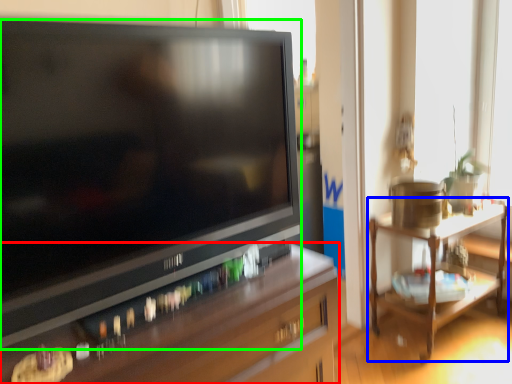
Question: Estimate the real-world distances between objects in this image. Which object is closer to desk (highlighted by a red box), table (highlighted by a blue box) or television (highlighted by a green box)?

Choices:
 (A) table
 (B) television

Answer: (B)